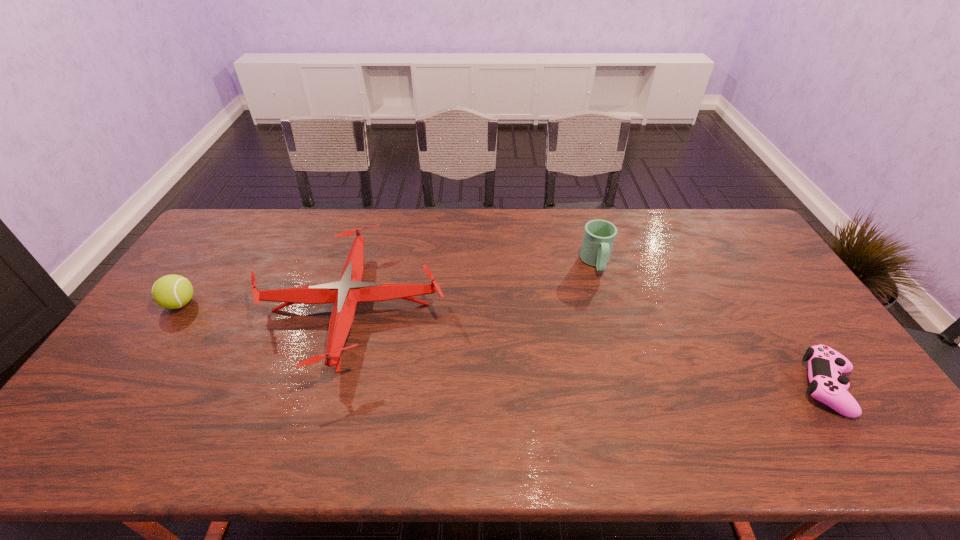
Find the location of `object that stands as the closest to the mug`. object that stands as the closest to the mug is located at coordinates (345, 294).

Identify the location of vacant area in the image that satisfies the following two spatial constraints: 1. on the side of the mug with the handle; 2. on the right side of the shortest object. (632, 387).

The image size is (960, 540). I want to click on vacant position in the image that satisfies the following two spatial constraints: 1. on the front side of the tennis ball; 2. on the right side of the third object from right to left, so click(178, 307).

Find the location of a particular element. This screenshot has width=960, height=540. vacant space that satisfies the following two spatial constraints: 1. on the side of the tallest object with the handle; 2. on the left side of the rightmost object is located at coordinates (632, 387).

Image resolution: width=960 pixels, height=540 pixels. Identify the location of vacant space that satisfies the following two spatial constraints: 1. on the side of the rightmost object with the handle; 2. on the right side of the third object from left to right. (632, 387).